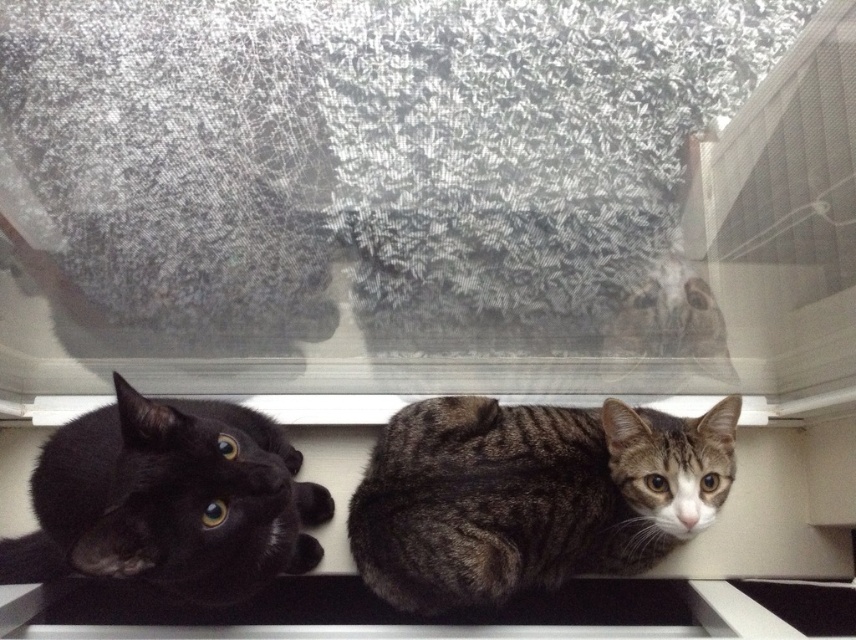
Question: Among these objects, which one is farthest from the camera?

Choices:
 (A) matte black cat at lower left
 (B) transparent glass window at center
 (C) tabby fur cat at lower right

Answer: (C)

Question: Does tabby fur cat at lower right have a greater width compared to white plastic window sill at center?

Choices:
 (A) no
 (B) yes

Answer: (A)

Question: Is tabby fur cat at lower right bigger than matte black cat at lower left?

Choices:
 (A) yes
 (B) no

Answer: (B)

Question: Which object appears farthest from the camera in this image?

Choices:
 (A) white plastic window sill at center
 (B) tabby fur cat at lower right
 (C) matte black cat at lower left

Answer: (A)

Question: Among these objects, which one is farthest from the camera?

Choices:
 (A) matte black cat at lower left
 (B) white plastic window sill at center

Answer: (B)

Question: Does transparent glass window at center have a larger size compared to tabby fur cat at lower right?

Choices:
 (A) yes
 (B) no

Answer: (A)